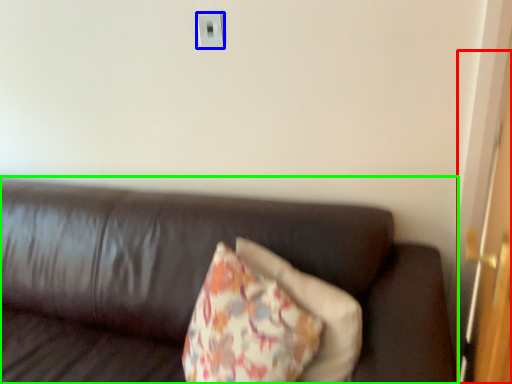
Question: Considering the real-world distances, which object is closest to door (highlighted by a red box)? electric outlet (highlighted by a blue box) or studio couch (highlighted by a green box).

Choices:
 (A) electric outlet
 (B) studio couch

Answer: (B)